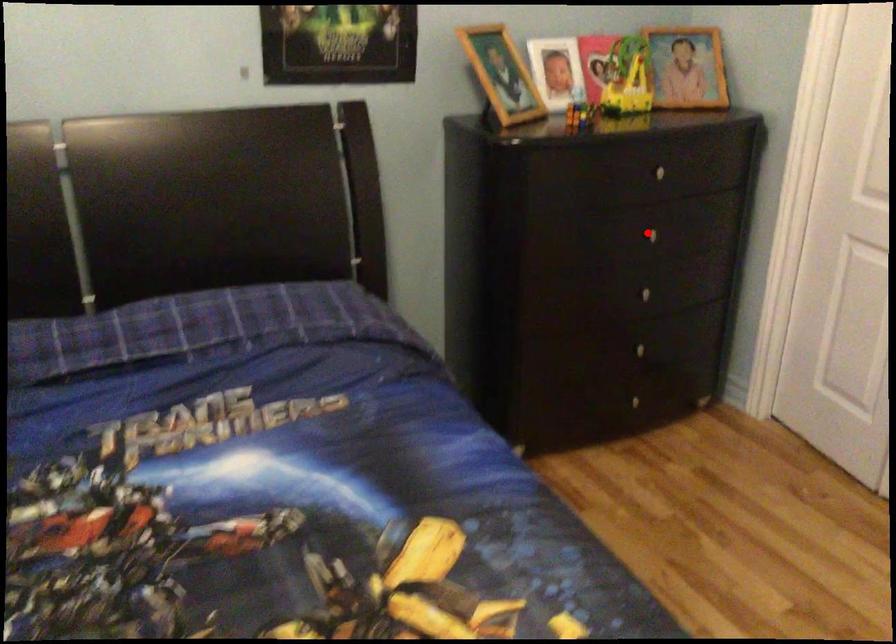
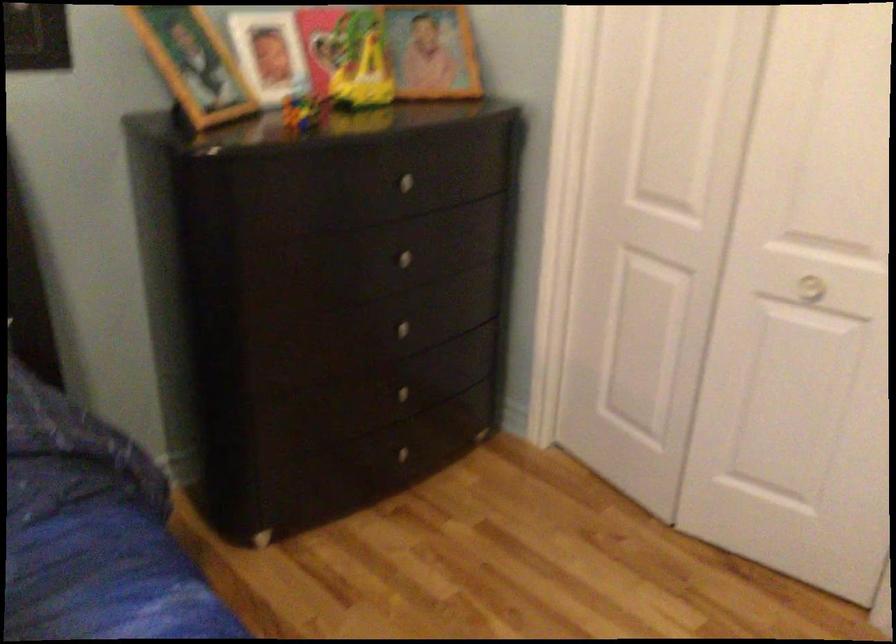
Where in the second image is the point corresponding to the highlighted location from the first image?

(399, 258)